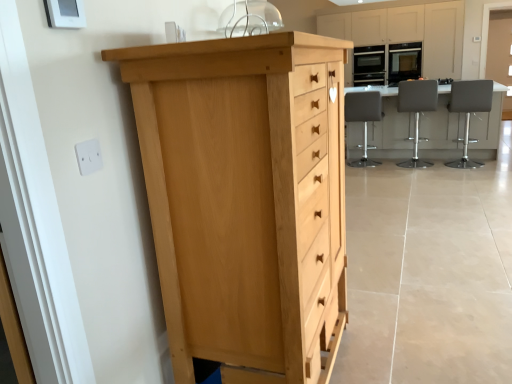
Question: From their relative heights in the image, would you say matte black oven at upper right, placed as the 1th appliance when sorted from left to right, is taller or shorter than gray leather bar stool at right, which is counted as the 3th chair, starting from the left?

Choices:
 (A) tall
 (B) short

Answer: (B)

Question: Is point (353, 74) positioned closer to the camera than point (465, 130)?

Choices:
 (A) closer
 (B) farther

Answer: (B)

Question: Based on their relative distances, which object is nearer to the white plastic electric outlet at upper left?

Choices:
 (A) leatherette stool at center, marked as the 2th chair in a left-to-right arrangement
 (B) light wood chest of drawers at left
 (C) matte black oven at upper right, the second appliance in the left-to-right sequence
 (D) matte black oven at upper right, marked as the second appliance in a right-to-left arrangement
 (E) white glossy table at center

Answer: (B)

Question: Based on their relative distances, which object is farther from the white leather stool at center, which is counted as the first chair, starting from the left?

Choices:
 (A) gray leather bar stool at right, which is counted as the 3th chair, starting from the left
 (B) matte black oven at upper right, the second appliance in the left-to-right sequence
 (C) leatherette stool at center, marked as the 2th chair in a left-to-right arrangement
 (D) white glossy table at center
 (E) matte black oven at upper right, marked as the second appliance in a right-to-left arrangement

Answer: (A)